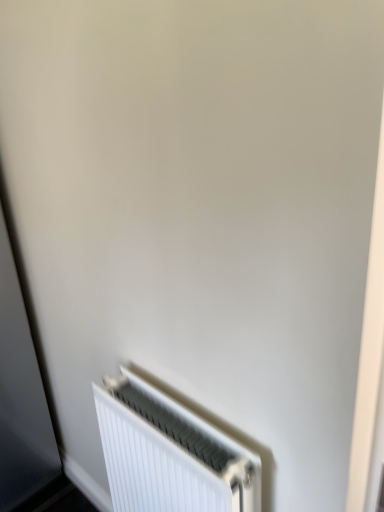
Question: Should I look upward or downward to see white plastic radiator at lower right?

Choices:
 (A) up
 (B) down

Answer: (B)